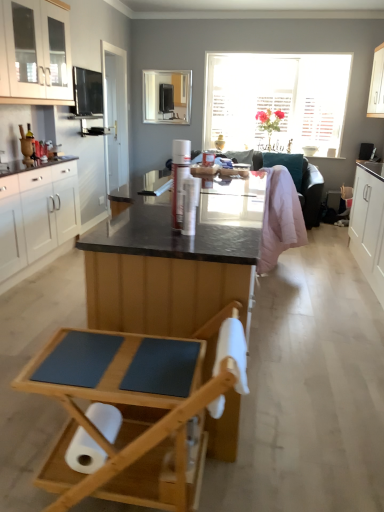
Question: Would you say white glossy door at center is to the left or to the right of pink quilted blanket at center in the picture?

Choices:
 (A) left
 (B) right

Answer: (A)

Question: Is point coord(112,101) positioned closer to the camera than point coord(266,215)?

Choices:
 (A) farther
 (B) closer

Answer: (A)

Question: Based on their relative distances, which object is farther from the white matte toilet paper at lower left, placed as the second toilet paper when sorted from right to left?

Choices:
 (A) white glossy cabinet at right, the second cabinetry when ordered from right to left
 (B) pink quilted blanket at center
 (C) white glossy door at center
 (D) white glossy cabinet at upper right, which is the fourth cabinetry from left to right
 (E) white glossy cabinets at upper left, positioned as the second cabinetry in left-to-right order

Answer: (D)

Question: Which is farther from the teal fabric couch at center?

Choices:
 (A) wooden folding chair at lower center
 (B) white matte toilet paper at lower center, positioned as the first toilet paper in front-to-back order
 (C) pink quilted blanket at center
 (D) white glossy cabinet at upper right, which is the fourth cabinetry from left to right
 (E) white matte toilet paper at lower left, marked as the second toilet paper in a front-to-back arrangement

Answer: (E)